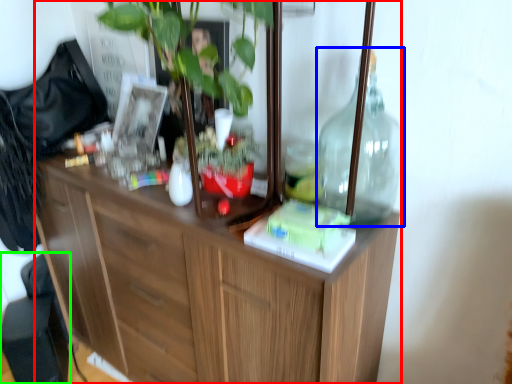
Question: Considering the real-world distances, which object is closest to cabinetry (highlighted by a red box)? bottle (highlighted by a blue box) or swivel chair (highlighted by a green box).

Choices:
 (A) bottle
 (B) swivel chair

Answer: (A)